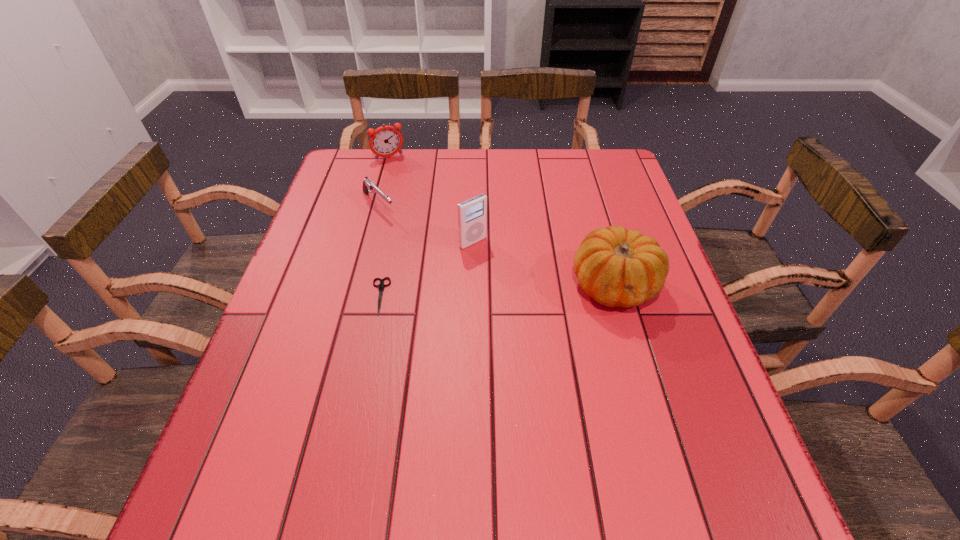
Locate an element on the screen. free spot between the second farthest object and the iPod is located at coordinates (425, 224).

Locate an element on the screen. The image size is (960, 540). vacant space in between the pistol and the farthest object is located at coordinates (384, 181).

You are a GUI agent. You are given a task and a screenshot of the screen. Output one action in this format:
    pyautogui.click(x=<x>, y=<y>)
    Task: Click on the free area in between the fourth tallest object and the shortest object
    Image resolution: width=960 pixels, height=540 pixels.
    Given the screenshot: What is the action you would take?
    pyautogui.click(x=379, y=251)

The height and width of the screenshot is (540, 960). I want to click on object that is the closest to the farthest object, so click(368, 186).

You are a GUI agent. You are given a task and a screenshot of the screen. Output one action in this format:
    pyautogui.click(x=<x>, y=<y>)
    Task: Click on the object that is the fourth closest to the fourth object from left to right
    
    Given the screenshot: What is the action you would take?
    pyautogui.click(x=385, y=141)

Locate an element on the screen. The width and height of the screenshot is (960, 540). vacant region that satisfies the following two spatial constraints: 1. on the front side of the pistol; 2. on the right side of the gourd is located at coordinates (357, 285).